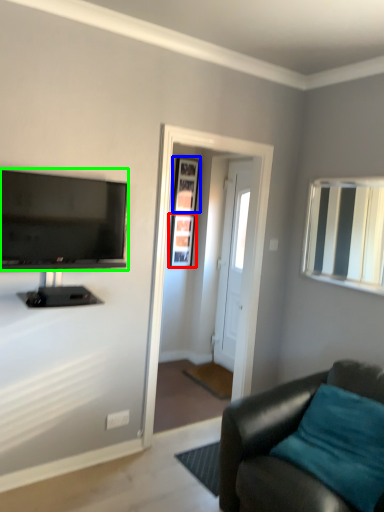
Question: Estimate the real-world distances between objects in this image. Which object is farther from picture frame (highlighted by a red box), picture frame (highlighted by a blue box) or television (highlighted by a green box)?

Choices:
 (A) picture frame
 (B) television

Answer: (B)